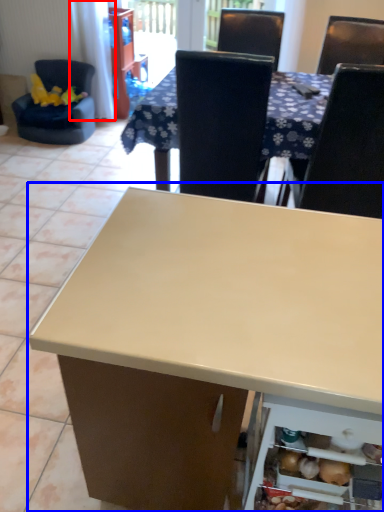
Question: Which of the following is the farthest to the observer, curtain (highlighted by a red box) or table (highlighted by a blue box)?

Choices:
 (A) curtain
 (B) table

Answer: (A)